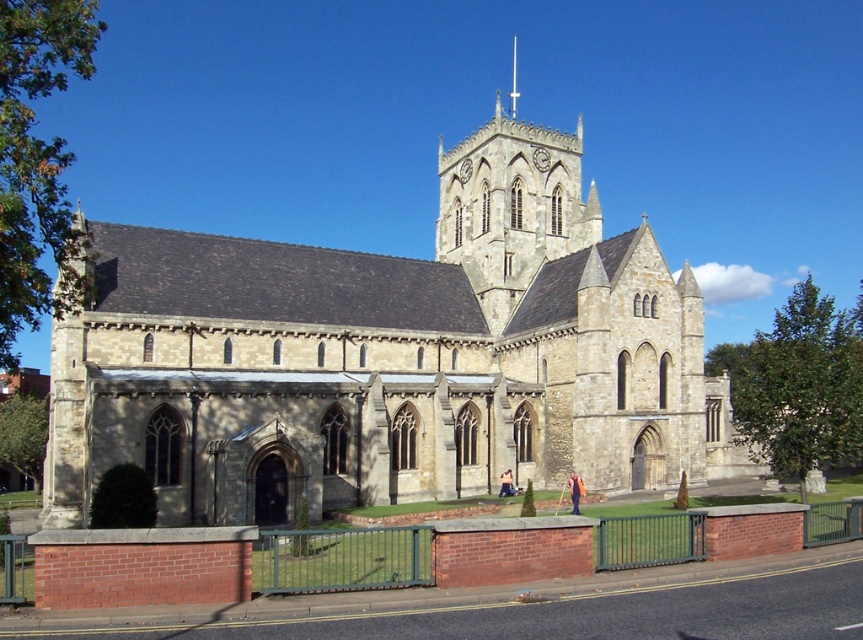
The width and height of the screenshot is (863, 640). What do you see at coordinates (389, 356) in the screenshot?
I see `stone church at center` at bounding box center [389, 356].

Who is higher up, stone church at center or smooth stone spire at center?

smooth stone spire at center is above.

Who is more forward, (615, 243) or (514, 52)?

Positioned in front is point (615, 243).

This screenshot has height=640, width=863. I want to click on stone church at center, so click(x=389, y=356).